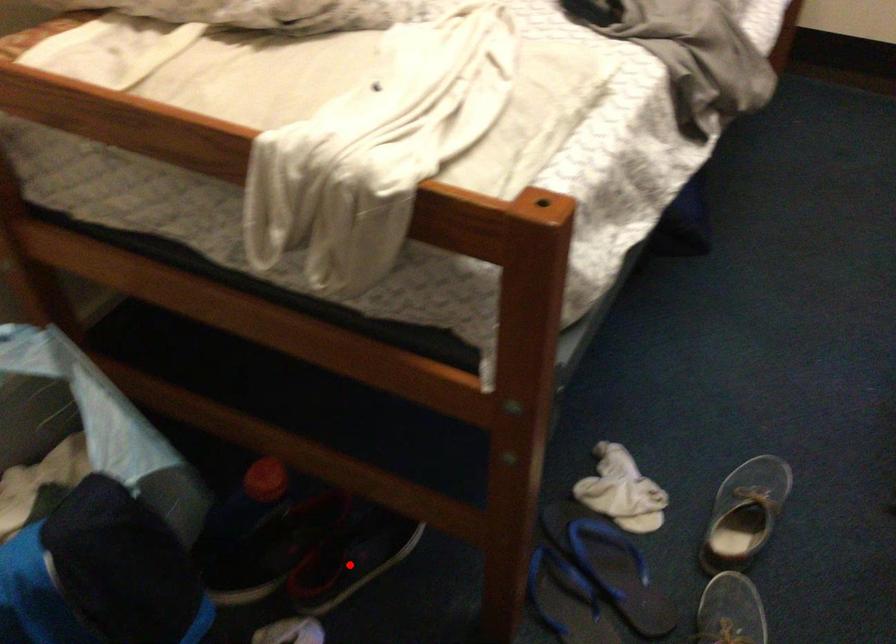
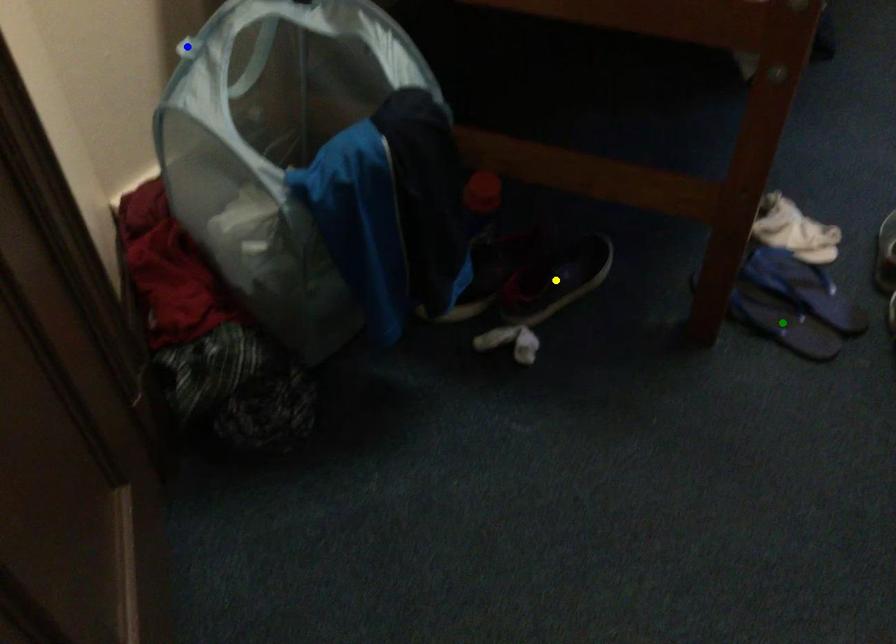
Question: I am providing you with two images of the same scene from different viewpoints. A red point is marked on the first image. You are given multiple points on the second image. Which mark in image 2 goes with the point in image 1?

Choices:
 (A) green point
 (B) yellow point
 (C) blue point

Answer: (B)